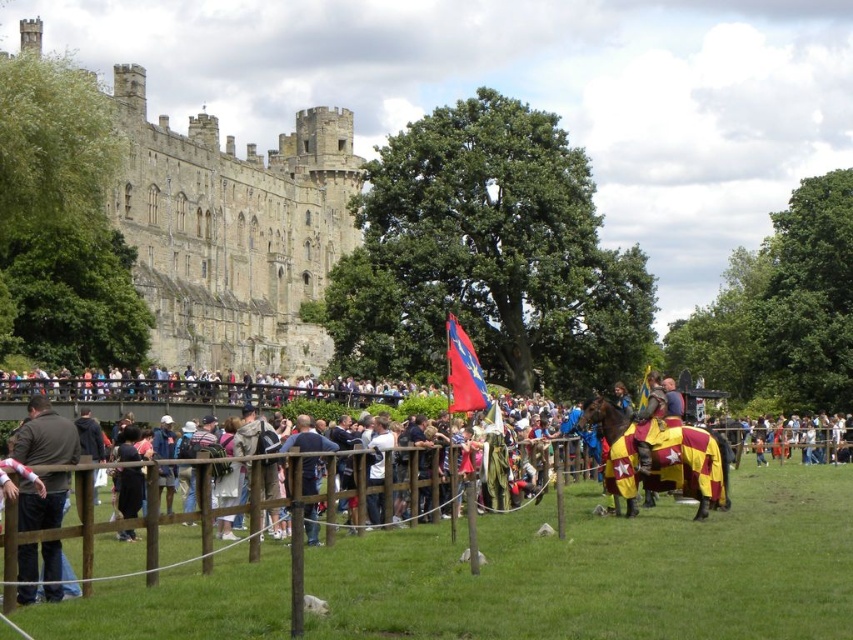
You are a performer at the medieval event and need to carry your dark brown leather jacket at lower left through the wooden fence at center to reach the stage. Can you pass through the fence without removing the jacket?

The wooden fence at center might be wider than dark brown leather jacket at lower left, so there is a possibility that the performer can pass through the fence without removing the jacket.

You are standing at the point marked as point (585, 570) in the image. What object are you currently standing on?

The point (585, 570) corresponds to the wooden fence at center, so you are standing on the wooden fence at center.